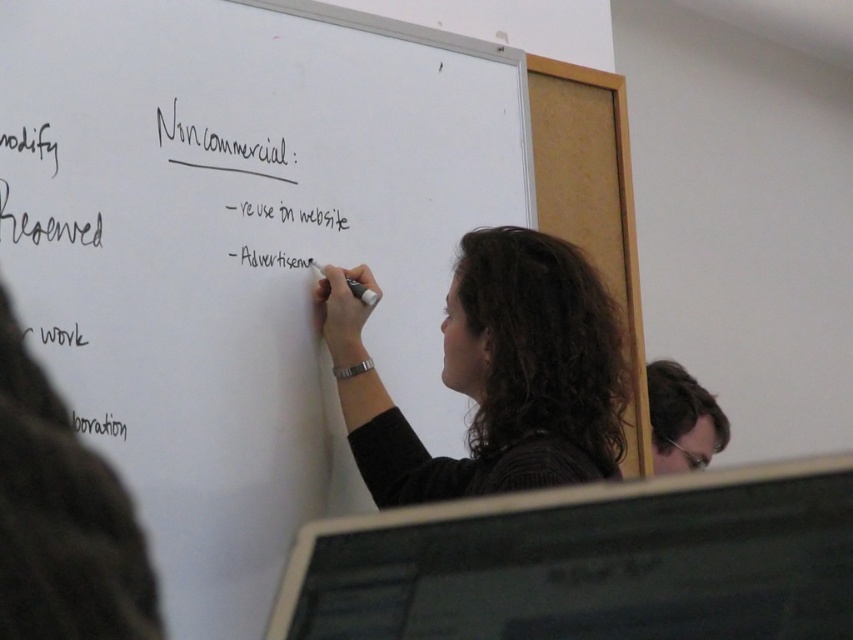
Is dark brown hair at center smaller than black marker text at upper center?

No, dark brown hair at center is not smaller than black marker text at upper center.

Which is in front, point (509, 276) or point (212, 141)?

Point (509, 276) is more forward.

Is point (403, 440) behind point (258, 154)?

Yes, point (403, 440) is farther from viewer.

The width and height of the screenshot is (853, 640). What are the coordinates of `dark brown hair at center` in the screenshot? It's located at (494, 372).

Is black marker at left shorter than black marker text at upper center?

Yes, black marker at left is shorter than black marker text at upper center.

Which is more to the left, black marker at left or black marker text at upper center?

black marker text at upper center

Describe the element at coordinates (62, 518) in the screenshot. I see `black marker at left` at that location.

The image size is (853, 640). In order to click on black marker at left in this screenshot , I will do `click(62, 518)`.

Which is above, white matte board at center or black marker text at upper center?

black marker text at upper center

Is point (186, 291) positioned in front of point (329, 224)?

Yes, it is in front of point (329, 224).

Where is `white matte board at center`? white matte board at center is located at coordinates (241, 248).